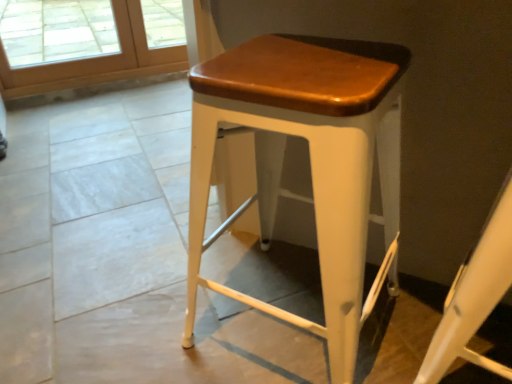
In order to face matte white stool at center, should I rotate leftwards or rightwards?

You should rotate right by 6.080 degrees.

What do you see at coordinates (474, 295) in the screenshot?
I see `white matte stool at center` at bounding box center [474, 295].

At what (x,y) coordinates should I click in order to perform the action: click on wooden screen door at upper left. Please return your answer as a coordinate pair (x, y). The height and width of the screenshot is (384, 512). Looking at the image, I should click on (97, 60).

From the image's perspective, is white matte stool at center positioned above or below wooden screen door at upper left?

Clearly, from the image's perspective, white matte stool at center is below wooden screen door at upper left.

Considering the relative sizes of white matte stool at center and wooden screen door at upper left in the image provided, is white matte stool at center shorter than wooden screen door at upper left?

No.

Is white matte stool at center oriented towards wooden screen door at upper left?

No, white matte stool at center is not facing towards wooden screen door at upper left.

Find the location of a particular element. The image size is (512, 384). screen door behind the white matte stool at center is located at coordinates (97, 60).

Is matte white stool at center oriented away from white matte stool at center?

No, matte white stool at center is not facing away from white matte stool at center.

Between matte white stool at center and white matte stool at center, which one has smaller size?

With smaller size is white matte stool at center.

Can you confirm if matte white stool at center is thinner than white matte stool at center?

No, matte white stool at center is not thinner than white matte stool at center.

Would you say matte white stool at center is outside white matte stool at center?

matte white stool at center lies outside white matte stool at center's area.

Is wooden screen door at upper left placed right next to matte white stool at center?

They are not placed beside each other.

Between wooden screen door at upper left and matte white stool at center, which one appears on the right side from the viewer's perspective?

From the viewer's perspective, matte white stool at center appears more on the right side.

Does point (8, 95) appear closer or farther from the camera than point (387, 214)?

Point (8, 95) is positioned farther from the camera compared to point (387, 214).

How far apart are wooden screen door at upper left and white matte stool at center?

wooden screen door at upper left is 7.76 feet away from white matte stool at center.

At what (x,y) coordinates should I click in order to perform the action: click on swivel chair to the right of wooden screen door at upper left. Please return your answer as a coordinate pair (x, y). Image resolution: width=512 pixels, height=384 pixels. Looking at the image, I should click on (474, 295).

Is wooden screen door at upper left inside or outside of white matte stool at center?

wooden screen door at upper left is spatially situated outside white matte stool at center.

From the image's perspective, between wooden screen door at upper left and white matte stool at center, which one is located above?

wooden screen door at upper left, from the image's perspective.

Considering the positions of objects matte white stool at center and wooden screen door at upper left in the image provided, who is more to the right, matte white stool at center or wooden screen door at upper left?

From the viewer's perspective, matte white stool at center appears more on the right side.

Measure the distance between matte white stool at center and wooden screen door at upper left.

matte white stool at center and wooden screen door at upper left are 6.50 feet apart from each other.

From a real-world perspective, is matte white stool at center above or below wooden screen door at upper left?

matte white stool at center is situated higher than wooden screen door at upper left in the real world.

This screenshot has height=384, width=512. I want to click on stool below the wooden screen door at upper left (from the image's perspective), so click(x=310, y=162).

Is matte white stool at center completely or partially inside white matte stool at center?

Actually, matte white stool at center is outside white matte stool at center.

Is white matte stool at center at the left side of matte white stool at center?

No, white matte stool at center is not to the left of matte white stool at center.

Looking at their sizes, would you say white matte stool at center is wider or thinner than matte white stool at center?

Considering their sizes, white matte stool at center looks slimmer than matte white stool at center.

Does white matte stool at center turn towards matte white stool at center?

No, white matte stool at center is not aimed at matte white stool at center.

Where is `screen door on the left of white matte stool at center`? This screenshot has width=512, height=384. screen door on the left of white matte stool at center is located at coordinates (97, 60).

Locate an element on the screen. This screenshot has height=384, width=512. swivel chair in front of the matte white stool at center is located at coordinates (474, 295).

When comparing their distances from matte white stool at center, does wooden screen door at upper left or white matte stool at center seem further?

Among the two, wooden screen door at upper left is located further to matte white stool at center.

In the scene shown: When comparing their distances from white matte stool at center, does matte white stool at center or wooden screen door at upper left seem further?

wooden screen door at upper left lies further to white matte stool at center than the other object.

Which object lies further to the anchor point wooden screen door at upper left, matte white stool at center or white matte stool at center?

white matte stool at center.

Based on their spatial positions, is white matte stool at center or matte white stool at center further from wooden screen door at upper left?

white matte stool at center lies further to wooden screen door at upper left than the other object.

Estimate the real-world distances between objects in this image. Which object is closer to white matte stool at center, wooden screen door at upper left or matte white stool at center?

Among the two, matte white stool at center is located nearer to white matte stool at center.

When comparing their distances from matte white stool at center, does white matte stool at center or wooden screen door at upper left seem closer?

white matte stool at center.

You are a GUI agent. You are given a task and a screenshot of the screen. Output one action in this format:
    pyautogui.click(x=<x>, y=<y>)
    Task: Click on the stool between white matte stool at center and wooden screen door at upper left in the front-back direction
    
    Given the screenshot: What is the action you would take?
    pyautogui.click(x=310, y=162)